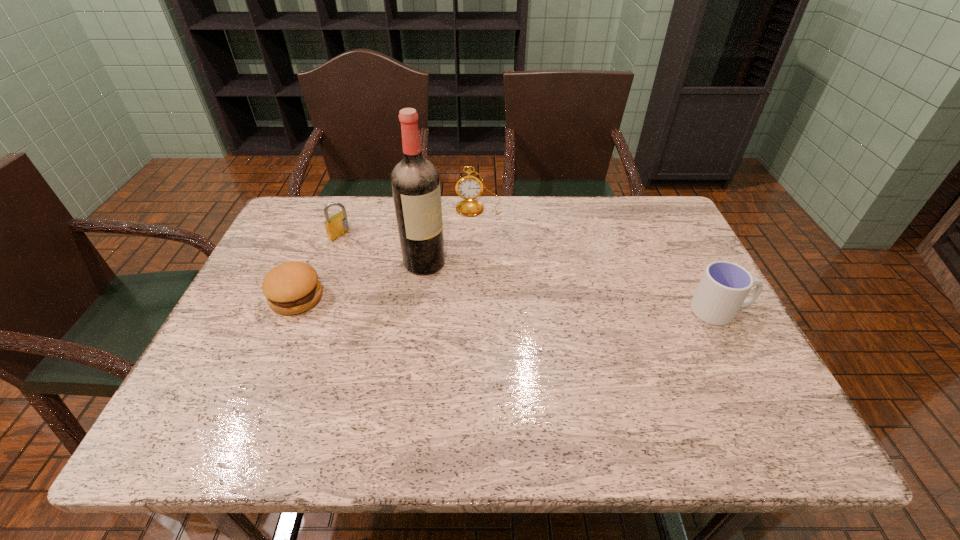
Locate an element on the screen. Image resolution: width=960 pixels, height=540 pixels. free spot on the desktop that is between the hamburger and the cup and is positioned on the front-facing side of the tallest object is located at coordinates (488, 303).

Where is `free space on the desktop that is between the hamburger and the rightmost object and is positioned on the face of the second object from right to left`? The width and height of the screenshot is (960, 540). free space on the desktop that is between the hamburger and the rightmost object and is positioned on the face of the second object from right to left is located at coordinates (483, 303).

At what (x,y) coordinates should I click in order to perform the action: click on vacant space on the desktop that is between the hamburger and the cup and is positioned on the side with the combination dials of the padlock. Please return your answer as a coordinate pair (x, y). Looking at the image, I should click on point(481,303).